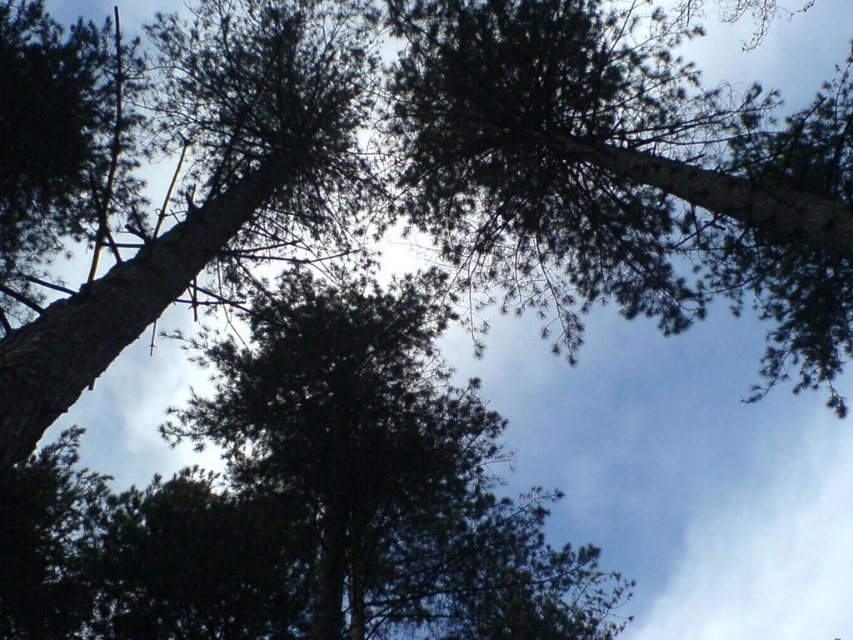
Question: Can you confirm if green needle-like at upper center is smaller than green textured tree trunk at left?

Choices:
 (A) yes
 (B) no

Answer: (A)

Question: Which point is closer to the camera?

Choices:
 (A) green textured tree trunk at left
 (B) dark green textured tree at center
 (C) green needle-like at upper center

Answer: (A)

Question: Considering the relative positions of green needle-like at upper center and green textured tree trunk at left in the image provided, where is green needle-like at upper center located with respect to green textured tree trunk at left?

Choices:
 (A) above
 (B) below

Answer: (A)

Question: Which point is closer to the camera?

Choices:
 (A) dark green textured tree at center
 (B) green needle-like at upper center

Answer: (B)

Question: Can you confirm if green needle-like at upper center is wider than dark green textured tree at center?

Choices:
 (A) yes
 (B) no

Answer: (A)

Question: Which object is positioned farthest from the green needle-like at upper center?

Choices:
 (A) dark green textured tree at center
 (B) green textured tree trunk at left

Answer: (B)